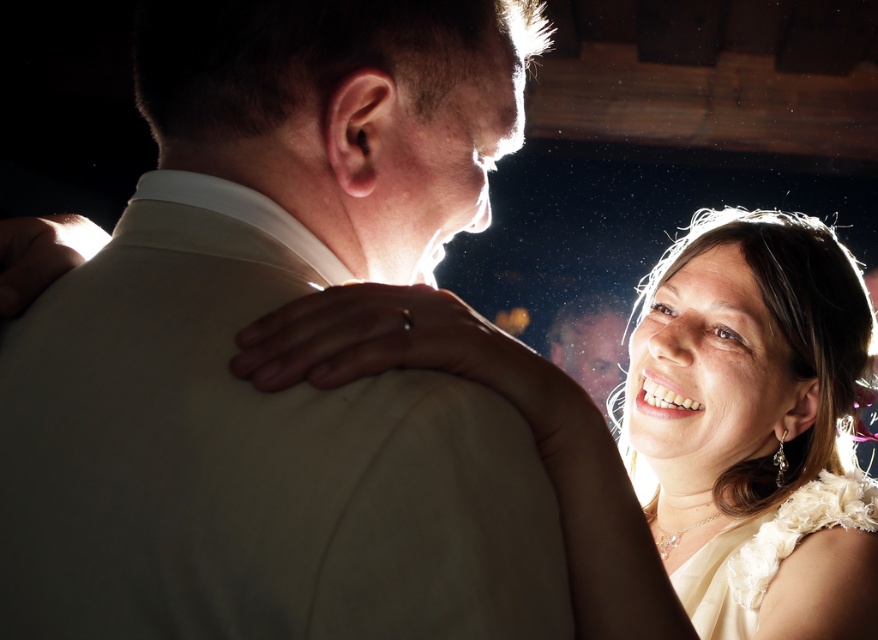
Question: Which object is closer to the camera taking this photo?

Choices:
 (A) white satin dress at center
 (B) matte white suit at center

Answer: (B)

Question: In this image, where is matte white suit at center located relative to white satin dress at center?

Choices:
 (A) right
 (B) left

Answer: (B)

Question: Which point is farther to the camera?

Choices:
 (A) white satin dress at center
 (B) matte white suit at center

Answer: (A)

Question: Is matte white suit at center thinner than white satin dress at center?

Choices:
 (A) no
 (B) yes

Answer: (B)

Question: Can you confirm if matte white suit at center is smaller than white satin dress at center?

Choices:
 (A) yes
 (B) no

Answer: (A)